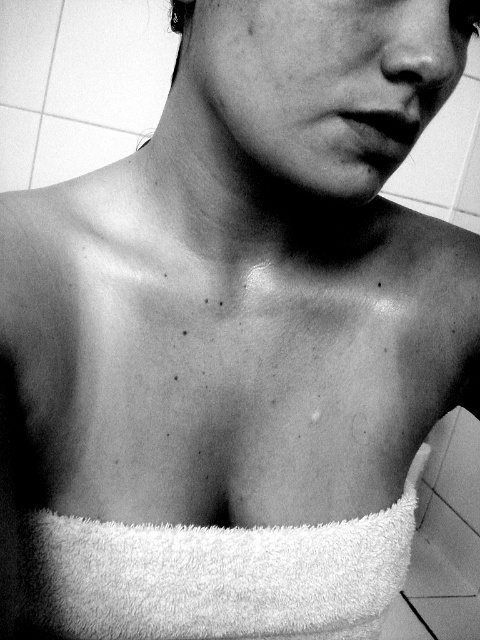
You are standing in a bathroom and see two points marked in the image. Which point is closer to you, point (x=47, y=572) or point (x=249, y=60)?

Point (x=249, y=60) is closer to you because point (x=47, y=572) is behind it.

In the scene shown: You are a photographer adjusting lighting in a bathroom scene. The subject has a white fluffy towel at center and smooth skin at center. To ensure proper focus on both elements, what is the minimum distance the camera should be set to focus at?

The white fluffy towel at center and smooth skin at center are 24.49 centimeters apart, so the camera should be focused at a distance that can capture both elements within the depth of field, which requires calculating based on their separation.

You are a photographer holding a camera 15.76 inches away from the white fluffy towel at center. You want to capture a closeup shot of the towel while ensuring the entire chest area of the person is still visible in the frame. Is the current distance sufficient to include both the towel and the chest in the photo?

The camera is 15.76 inches away from the white fluffy towel at center. Since the distance is fixed, adjusting the camera angle or zoom might be necessary to ensure both the towel and the chest area are visible in the frame.